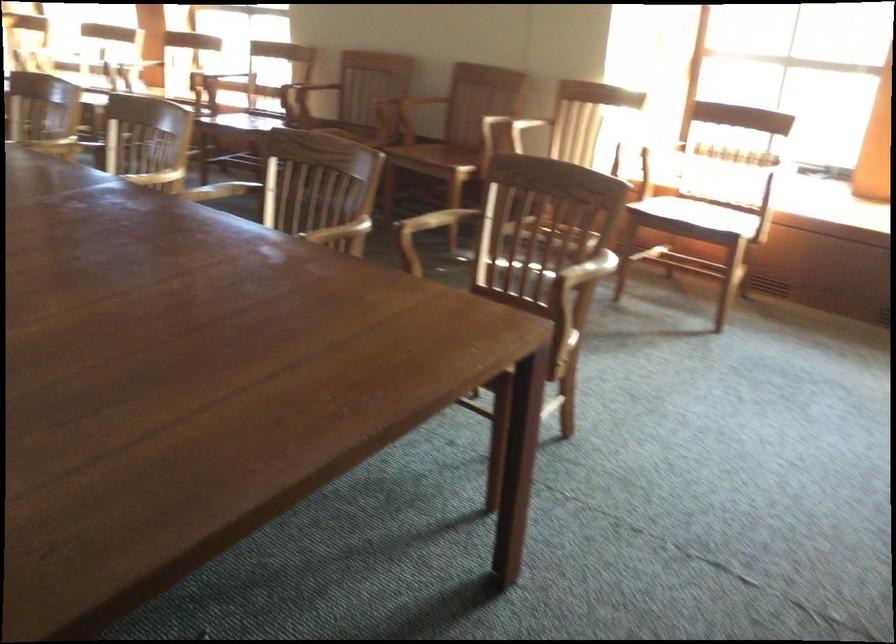
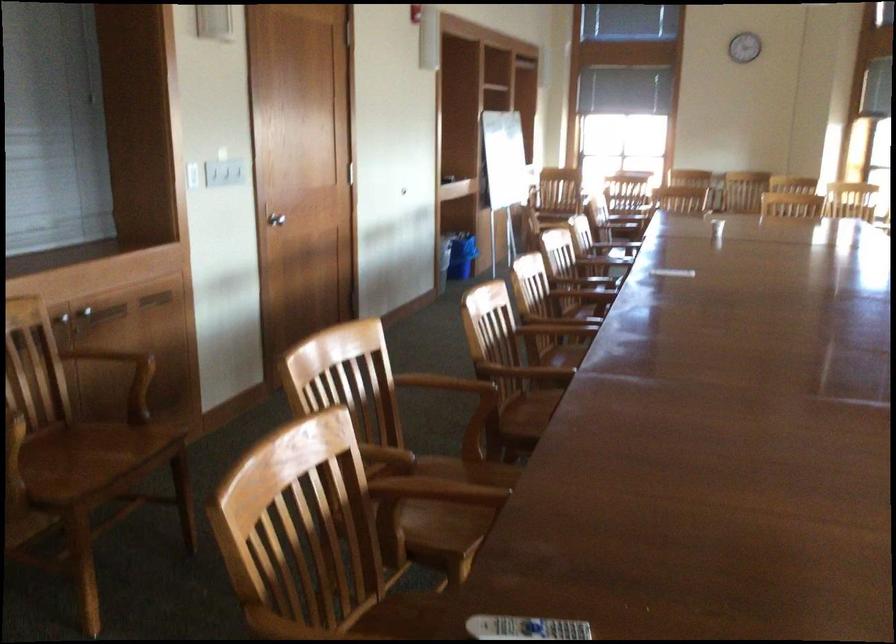
Question: The camera is either moving clockwise (left) or counter-clockwise (right) around the object. The first image is from the beginning of the video and the second image is from the end. Is the camera moving left or right when shooting the video?

Choices:
 (A) Left
 (B) Right

Answer: (B)